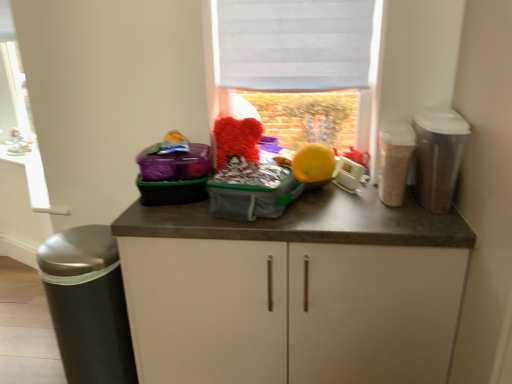
This screenshot has height=384, width=512. Find the location of `translucent plastic canister at right, the third appliance in the left-to-right sequence`. translucent plastic canister at right, the third appliance in the left-to-right sequence is located at coordinates (438, 156).

At what (x,y) coordinates should I click in order to perform the action: click on white plastic window frame at left. Please return your answer as a coordinate pair (x, y). This screenshot has height=384, width=512. Looking at the image, I should click on (19, 108).

Find the location of a particular element. The image size is (512, 384). porcelain figurine at left is located at coordinates (19, 143).

What is the approximate height of plastic gray bag at center?

plastic gray bag at center is 5.60 inches in height.

In order to click on white fabric at upper center in this screenshot , I will do `click(300, 48)`.

From a real-world perspective, is white matte cabinet at center on plastic gray bag at center?

No, from a real-world perspective, white matte cabinet at center is not above plastic gray bag at center.

Between white matte cabinet at center and plastic gray bag at center, which one is positioned behind?

plastic gray bag at center is behind.

Which of these two, white matte cabinet at center or plastic gray bag at center, is bigger?

Bigger between the two is white matte cabinet at center.

Is translucent plastic container at right, placed as the 2th appliance when sorted from left to right, thinner than white plastic toaster at center, arranged as the 3th appliance when viewed from the right?

Incorrect, the width of translucent plastic container at right, placed as the 2th appliance when sorted from left to right, is not less than that of white plastic toaster at center, arranged as the 3th appliance when viewed from the right.

From the picture: From the image's perspective, would you say translucent plastic container at right, positioned as the 2th appliance in right-to-left order, is positioned over white plastic toaster at center, the first appliance from the left?

Correct, translucent plastic container at right, positioned as the 2th appliance in right-to-left order, appears higher than white plastic toaster at center, the first appliance from the left, in the image.

Does point (384, 203) lie behind point (355, 181)?

No, (384, 203) is in front of (355, 181).

Which object is further away from the camera, translucent plastic container at right, positioned as the 2th appliance in right-to-left order, or white plastic toaster at center, the first appliance from the left?

white plastic toaster at center, the first appliance from the left, is behind.

Consider the image. Between white fabric at upper center and plastic gray bag at center, which one has smaller size?

Smaller between the two is plastic gray bag at center.

Based on the photo, from a real-world perspective, is white fabric at upper center located higher than plastic gray bag at center?

Yes, from a real-world perspective, white fabric at upper center is over plastic gray bag at center

Considering the relative positions of white fabric at upper center and plastic gray bag at center in the image provided, is white fabric at upper center behind plastic gray bag at center?

Yes, white fabric at upper center is further from the camera.

Is white fabric at upper center wider than white matte cabinet at center?

No.

From the picture: Can you tell me how much white fabric at upper center and white matte cabinet at center differ in facing direction?

0.185 degrees.

Considering their positions, is white fabric at upper center located in front of or behind white matte cabinet at center?

In the image, white fabric at upper center appears behind white matte cabinet at center.

Is point (216, 110) in front of point (271, 284)?

No, (216, 110) is further to viewer.

Considering the sizes of objects white plastic window frame at left and plastic gray bag at center in the image provided, who is thinner, white plastic window frame at left or plastic gray bag at center?

white plastic window frame at left is thinner.

In the image, is white plastic window frame at left positioned in front of or behind plastic gray bag at center?

white plastic window frame at left is behind plastic gray bag at center.

How different are the orientations of white plastic window frame at left and plastic gray bag at center in degrees?

The angle between the facing direction of white plastic window frame at left and the facing direction of plastic gray bag at center is 24.1 degrees.

Is white plastic window frame at left inside or outside of plastic gray bag at center?

white plastic window frame at left is outside plastic gray bag at center.

In the image, there is a plastic gray bag at center. Where is `window above it (from the image's perspective)`? window above it (from the image's perspective) is located at coordinates (300, 48).

From the image's perspective, which is below, plastic gray bag at center or white fabric at upper center?

plastic gray bag at center.

Is plastic gray bag at center at the right side of white fabric at upper center?

Incorrect, plastic gray bag at center is not on the right side of white fabric at upper center.

From a real-world perspective, is plastic gray bag at center beneath white fabric at upper center?

Yes, from a real-world perspective, plastic gray bag at center is beneath white fabric at upper center.

Is translucent plastic container at right, placed as the 2th appliance when sorted from left to right, further to the viewer compared to white plastic window frame at left?

No, it is not.

Which object is wider, translucent plastic container at right, placed as the 2th appliance when sorted from left to right, or white plastic window frame at left?

With larger width is translucent plastic container at right, placed as the 2th appliance when sorted from left to right.

From their relative heights in the image, would you say translucent plastic container at right, placed as the 2th appliance when sorted from left to right, is taller or shorter than white plastic window frame at left?

In the image, translucent plastic container at right, placed as the 2th appliance when sorted from left to right, appears to be shorter than white plastic window frame at left.

From a real-world perspective, is translucent plastic container at right, positioned as the 2th appliance in right-to-left order, above or below white plastic window frame at left?

translucent plastic container at right, positioned as the 2th appliance in right-to-left order, is situated lower than white plastic window frame at left in the real world.

At what (x,y) coordinates should I click in order to perform the action: click on kit behind the white matte cabinet at center. Please return your answer as a coordinate pair (x, y). Image resolution: width=512 pixels, height=384 pixels. Looking at the image, I should click on (251, 190).

In the image, there is a translucent plastic container at right, placed as the 2th appliance when sorted from left to right. In order to click on appliance below it (from a real-world perspective) in this screenshot , I will do `click(347, 174)`.

Looking at the image, which one is located further to porcelain figurine at left, white matte cabinet at center or fluffy red teddy bear at center?

white matte cabinet at center is positioned further to the anchor porcelain figurine at left.

From the picture: Considering their positions, is porcelain figurine at left positioned further to translucent plastic container at right, positioned as the 2th appliance in right-to-left order, than fluffy red teddy bear at center?

Based on the image, porcelain figurine at left appears to be further to translucent plastic container at right, positioned as the 2th appliance in right-to-left order.

When comparing their distances from white matte cabinet at center, does white plastic toaster at center, arranged as the 3th appliance when viewed from the right, or translucent plastic canister at right, the third appliance in the left-to-right sequence, seem closer?

The object closer to white matte cabinet at center is translucent plastic canister at right, the third appliance in the left-to-right sequence.

Looking at the image, which one is located further to white fabric at upper center, white plastic window frame at left or translucent plastic canister at right, the third appliance in the left-to-right sequence?

Among the two, white plastic window frame at left is located further to white fabric at upper center.

Based on their spatial positions, is white fabric blind at upper center or fluffy red teddy bear at center closer to porcelain figurine at left?

fluffy red teddy bear at center lies closer to porcelain figurine at left than the other object.

Looking at the image, which one is located further to translucent plastic canister at right, the first appliance when ordered from right to left, fluffy red teddy bear at center or white fabric at upper center?

fluffy red teddy bear at center is positioned further to the anchor translucent plastic canister at right, the first appliance when ordered from right to left.

When comparing their distances from porcelain figurine at left, does fluffy red teddy bear at center or white fabric blind at upper center seem closer?

fluffy red teddy bear at center.

Which object lies nearer to the anchor point white fabric blind at upper center, translucent plastic canister at right, the third appliance in the left-to-right sequence, or fluffy red teddy bear at center?

fluffy red teddy bear at center lies closer to white fabric blind at upper center than the other object.

Locate an element on the screen. teddy between white fabric at upper center and plastic gray bag at center in the up-down direction is located at coordinates (236, 139).

Find the location of `appliance between fluffy red teddy bear at center and translucent plastic container at right, placed as the 2th appliance when sorted from left to right, in the horizontal direction`. appliance between fluffy red teddy bear at center and translucent plastic container at right, placed as the 2th appliance when sorted from left to right, in the horizontal direction is located at coordinates (347, 174).

This screenshot has width=512, height=384. I want to click on teddy located between white plastic window frame at left and white fabric blind at upper center in the left-right direction, so click(236, 139).

Find the location of a particular element. Image resolution: width=512 pixels, height=384 pixels. cabinetry between white plastic window frame at left and translucent plastic container at right, placed as the 2th appliance when sorted from left to right, in the horizontal direction is located at coordinates (290, 311).